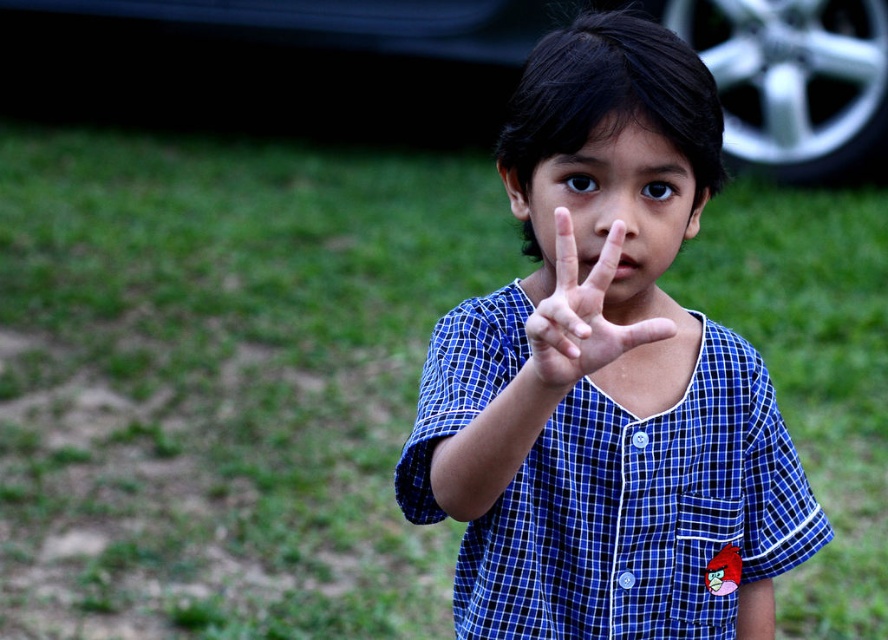
Does blue checkered shirt at center have a lesser height compared to metallic silver car at upper right?

Yes.

Is point (609, 65) positioned after point (486, 20)?

No, it is not.

At what (x,y) coordinates should I click in order to perform the action: click on blue checkered shirt at center. Please return your answer as a coordinate pair (x, y). The image size is (888, 640). Looking at the image, I should click on (607, 378).

Where is `blue checkered shirt at center`? The height and width of the screenshot is (640, 888). blue checkered shirt at center is located at coordinates (607, 378).

Which is in front, point (805, 131) or point (575, 285)?

Point (575, 285) is more forward.

Can you confirm if metallic silver car at upper right is positioned to the right of blue plaid shirt at center?

Indeed, metallic silver car at upper right is positioned on the right side of blue plaid shirt at center.

Where is `metallic silver car at upper right`? The image size is (888, 640). metallic silver car at upper right is located at coordinates coord(616,8).

Is blue checkered shirt at center shorter than blue plaid shirt at center?

No.

The width and height of the screenshot is (888, 640). What do you see at coordinates (607, 378) in the screenshot?
I see `blue checkered shirt at center` at bounding box center [607, 378].

Between point (644, 298) and point (593, 275), which one is positioned behind?

The point (644, 298) is behind.

I want to click on blue checkered shirt at center, so click(607, 378).